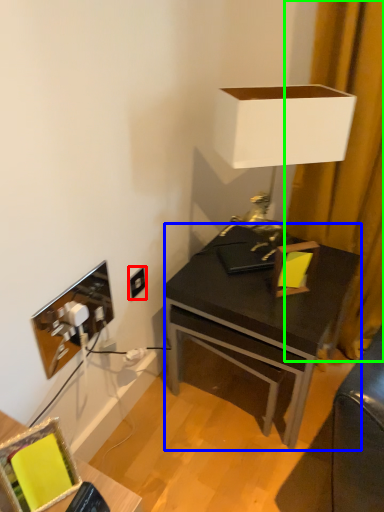
Question: Which object is the farthest from power outlet (highlighted by a red box)? Choose among these: desk (highlighted by a blue box) or curtain (highlighted by a green box).

Choices:
 (A) desk
 (B) curtain

Answer: (B)